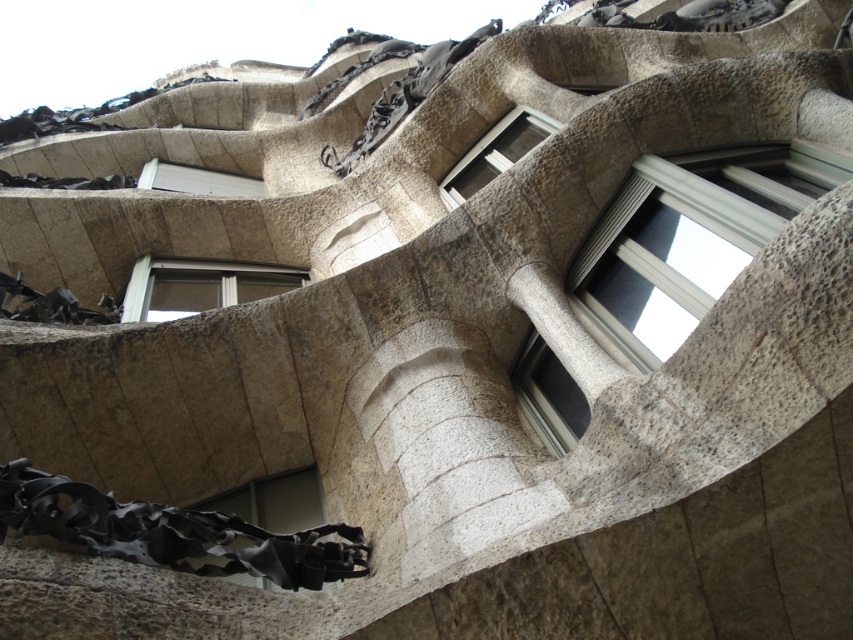
Based on the photo, you are standing in front of the architectural structure shown. There is a clear glass window at upper center located at point (495, 152). Can you see the reflection of the sky in this window?

The clear glass window at upper center has reflections that hint at a bright, overcast sky, so yes, you can see the reflection of the sky in this window.

You are an architect analyzing the building facade. You need to determine which window, the clear glass window at center or the matte black window at lower left, is narrower. Which one is narrower?

The clear glass window at center has a lesser width compared to the matte black window at lower left, so the clear glass window at center is narrower.

You are an architect analyzing the structure. Which window, the clear glass window at upper center or the white plastic window at upper center, takes up more space in the architectural design?

The white plastic window at upper center occupies more space than the clear glass window at upper center according to the description.